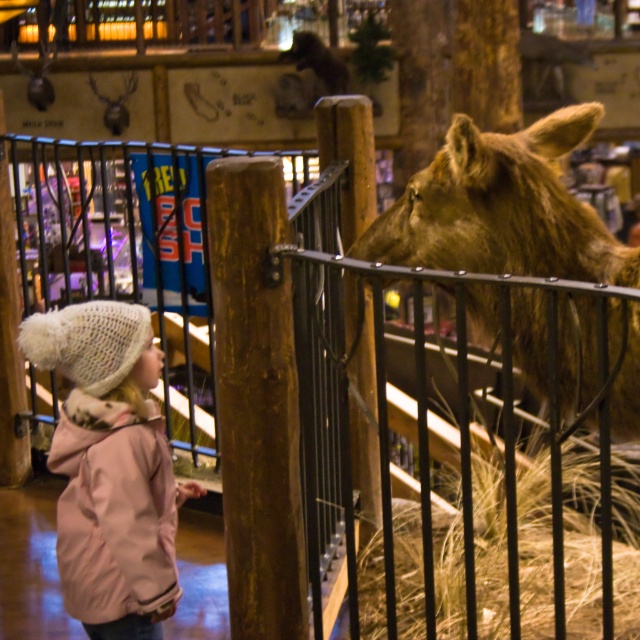
Where is `brown furry moose at upper right`? Image resolution: width=640 pixels, height=640 pixels. brown furry moose at upper right is located at coordinates (500, 209).

Does brown furry moose at upper right have a smaller size compared to pink fleece jacket at lower left?

Actually, brown furry moose at upper right might be larger than pink fleece jacket at lower left.

The height and width of the screenshot is (640, 640). What do you see at coordinates (500, 209) in the screenshot?
I see `brown furry moose at upper right` at bounding box center [500, 209].

The width and height of the screenshot is (640, 640). I want to click on brown furry moose at upper right, so click(500, 209).